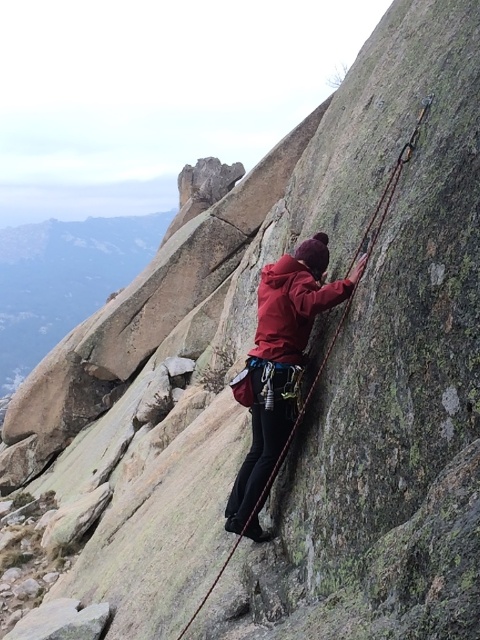
Question: Is matte red jacket at center to the left of rope at center from the viewer's perspective?

Choices:
 (A) no
 (B) yes

Answer: (B)

Question: Which point is farther to the camera?

Choices:
 (A) (263, 531)
 (B) (191, 621)

Answer: (A)

Question: Is matte red jacket at center to the left of rope at center from the viewer's perspective?

Choices:
 (A) no
 (B) yes

Answer: (B)

Question: In this image, where is matte red jacket at center located relative to rope at center?

Choices:
 (A) above
 (B) below

Answer: (B)

Question: Which point is closer to the camera taking this photo?

Choices:
 (A) (266, 310)
 (B) (350, 266)

Answer: (B)

Question: Which point is farther to the camera?

Choices:
 (A) (358, 256)
 (B) (300, 259)

Answer: (B)